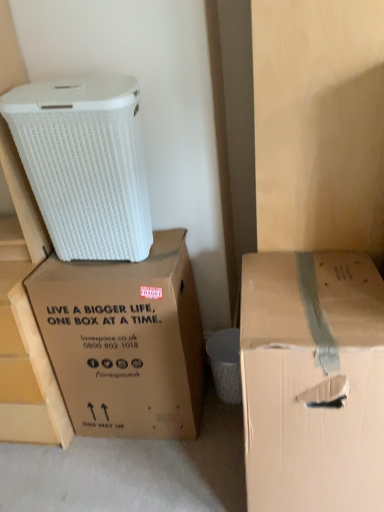
Image resolution: width=384 pixels, height=512 pixels. In order to click on vacant area that is in front of brown cardboard box at center, the 2th box viewed from the right in this screenshot , I will do `click(140, 473)`.